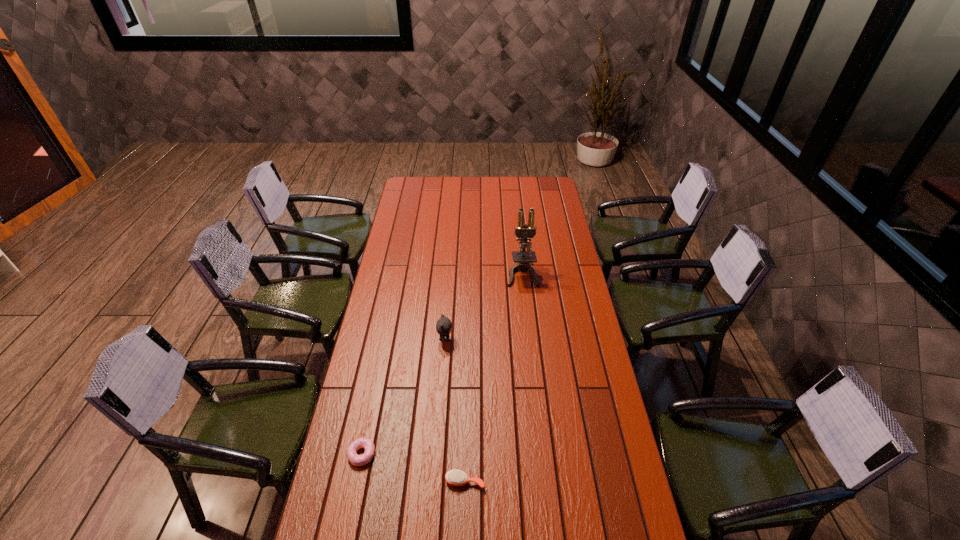
You are a GUI agent. You are given a task and a screenshot of the screen. Output one action in this format:
    pyautogui.click(x=<x>, y=<y>)
    Task: Click on the farthest object
    The height and width of the screenshot is (540, 960).
    Given the screenshot: What is the action you would take?
    pyautogui.click(x=523, y=258)

Locate an element on the screen. This screenshot has height=540, width=960. microscope is located at coordinates (523, 258).

You are a GUI agent. You are given a task and a screenshot of the screen. Output one action in this format:
    pyautogui.click(x=<x>, y=<y>)
    Task: Click on the kitten
    The height and width of the screenshot is (540, 960).
    Given the screenshot: What is the action you would take?
    pyautogui.click(x=443, y=326)

This screenshot has height=540, width=960. In order to click on the third object from right to left in this screenshot , I will do `click(443, 326)`.

The width and height of the screenshot is (960, 540). Find the location of `the nearest object`. the nearest object is located at coordinates (454, 477).

At what (x,y) coordinates should I click in order to perform the action: click on hairbrush. Please return your answer as a coordinate pair (x, y). The width and height of the screenshot is (960, 540). Looking at the image, I should click on (454, 477).

The image size is (960, 540). Identify the location of the third farthest object. (358, 460).

This screenshot has height=540, width=960. In order to click on the leftmost object in this screenshot , I will do `click(358, 460)`.

You are a GUI agent. You are given a task and a screenshot of the screen. Output one action in this format:
    pyautogui.click(x=<x>, y=<y>)
    Task: Click on the vacant region located at the eyepieces of the microscope
    
    Given the screenshot: What is the action you would take?
    pyautogui.click(x=526, y=309)

What are the coordinates of `free location located 0.140m on the front-facing side of the second farthest object` in the screenshot? It's located at (488, 339).